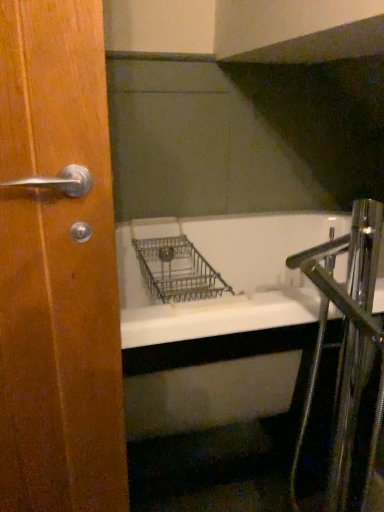
Question: Considering the relative positions of chrome metallic faucet at right and wooden door handle at left in the image provided, is chrome metallic faucet at right to the right of wooden door handle at left from the viewer's perspective?

Choices:
 (A) yes
 (B) no

Answer: (A)

Question: From the image's perspective, is chrome metallic faucet at right located beneath wooden door handle at left?

Choices:
 (A) no
 (B) yes

Answer: (B)

Question: Is chrome metallic faucet at right thinner than wooden door handle at left?

Choices:
 (A) no
 (B) yes

Answer: (A)

Question: Considering the relative positions of chrome metallic faucet at right and wooden door handle at left in the image provided, is chrome metallic faucet at right behind wooden door handle at left?

Choices:
 (A) no
 (B) yes

Answer: (B)

Question: Would you say wooden door handle at left is part of chrome metallic faucet at right's contents?

Choices:
 (A) yes
 (B) no

Answer: (B)

Question: From a real-world perspective, is chrome metallic faucet at right located higher than wooden door handle at left?

Choices:
 (A) yes
 (B) no

Answer: (B)

Question: Is wooden door handle at left wider than chrome metallic faucet at right?

Choices:
 (A) yes
 (B) no

Answer: (B)

Question: Is wooden door handle at left shorter than chrome metallic faucet at right?

Choices:
 (A) no
 (B) yes

Answer: (A)

Question: Can you confirm if wooden door handle at left is positioned to the right of chrome metallic faucet at right?

Choices:
 (A) no
 (B) yes

Answer: (A)

Question: Is wooden door handle at left looking in the opposite direction of chrome metallic faucet at right?

Choices:
 (A) yes
 (B) no

Answer: (B)

Question: Considering the relative positions of wooden door handle at left and chrome metallic faucet at right in the image provided, is wooden door handle at left to the left of chrome metallic faucet at right from the viewer's perspective?

Choices:
 (A) no
 (B) yes

Answer: (B)

Question: Is wooden door handle at left not close to chrome metallic faucet at right?

Choices:
 (A) no
 (B) yes

Answer: (A)

Question: In terms of height, does wooden door handle at left look taller or shorter compared to chrome metallic faucet at right?

Choices:
 (A) tall
 (B) short

Answer: (A)